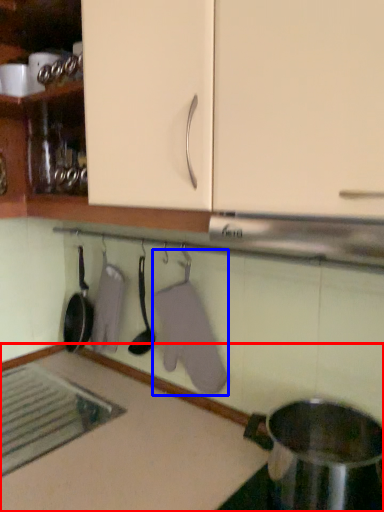
Question: Among these objects, which one is farthest to the camera, countertop (highlighted by a red box) or laundry (highlighted by a blue box)?

Choices:
 (A) countertop
 (B) laundry

Answer: (B)